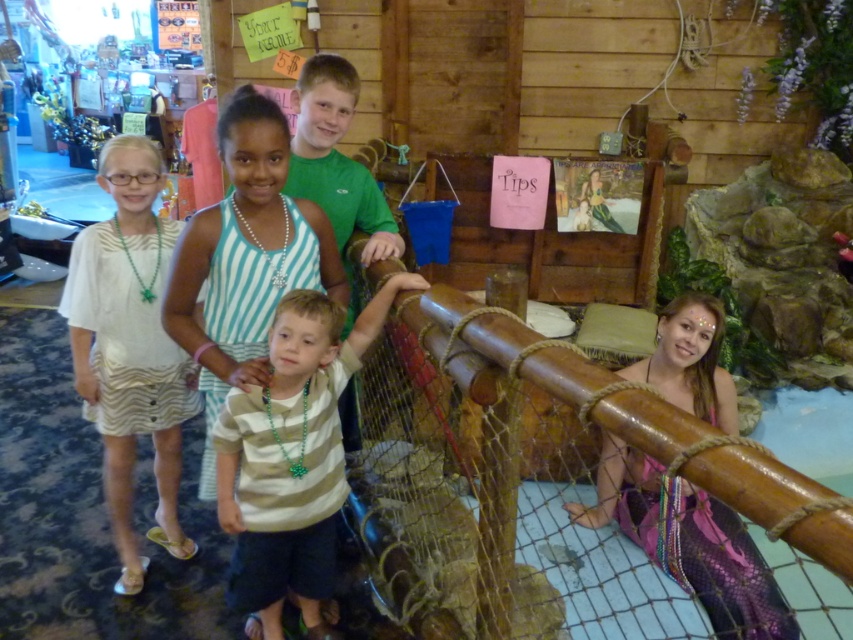
Question: Which point appears farthest from the camera in this image?

Choices:
 (A) (334, 320)
 (B) (125, 524)
 (C) (587, 436)

Answer: (C)

Question: Is striped cotton shirt at center to the right of white striped dress at left from the viewer's perspective?

Choices:
 (A) no
 (B) yes

Answer: (B)

Question: Which of the following is the closest to the observer?

Choices:
 (A) (462, 435)
 (B) (283, 573)

Answer: (B)

Question: Which point is closer to the camera taking this photo?

Choices:
 (A) (332, 554)
 (B) (585, 371)
 (C) (100, 429)

Answer: (B)

Question: In this image, where is striped cotton shirt at center located relative to white striped dress at left?

Choices:
 (A) above
 (B) below

Answer: (B)

Question: Is wooden at upper center above striped cotton shirt at center?

Choices:
 (A) yes
 (B) no

Answer: (B)